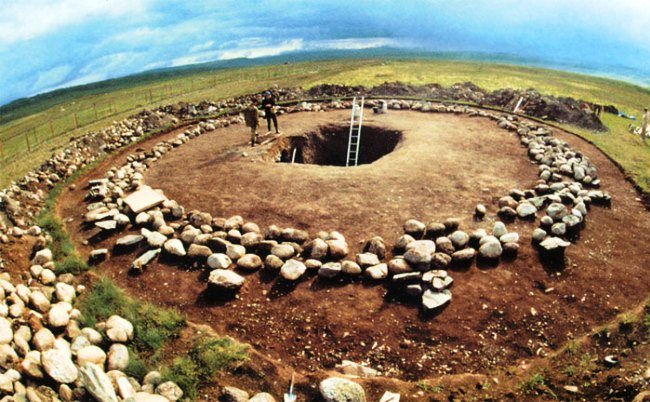
This screenshot has height=402, width=650. I want to click on ladder, so click(x=351, y=105).